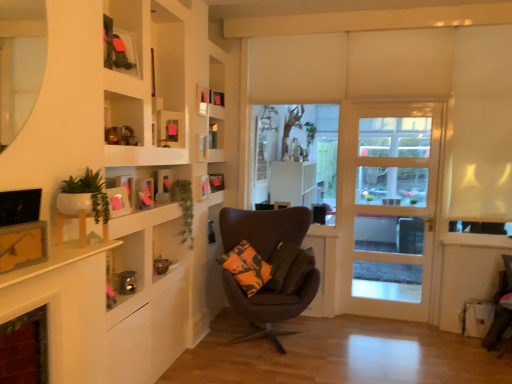
At what (x,y) coordinates should I click in order to perform the action: click on matte pink picture frame at upper center, positioned as the 3th picture frame in back-to-front order. Please return your answer as a coordinate pair (x, y). Looking at the image, I should click on (203, 187).

Describe the element at coordinates (289, 268) in the screenshot. I see `orange patterned pillow at center` at that location.

Describe the element at coordinates (146, 84) in the screenshot. The height and width of the screenshot is (384, 512). I see `wooden shelves at upper left` at that location.

The image size is (512, 384). What are the coordinates of `pink matte picture frame at upper center, acting as the 8th picture frame starting from the back` in the screenshot? It's located at (145, 193).

You are a GUI agent. You are given a task and a screenshot of the screen. Output one action in this format:
    pyautogui.click(x=<x>, y=<y>)
    Task: Click on the matte white picture frame at upper center, positioned as the seventh picture frame in front-to-back order
    
    Given the screenshot: What is the action you would take?
    pyautogui.click(x=202, y=100)

Is velvet dark brown chair at lower right, arranged as the first chair when viewed from the right, next to wooden picture frame at upper center, the 8th picture frame when ordered from front to back?

No, velvet dark brown chair at lower right, arranged as the first chair when viewed from the right, is not next to wooden picture frame at upper center, the 8th picture frame when ordered from front to back.

Does velvet dark brown chair at lower right, arranged as the first chair when viewed from the right, appear on the right side of wooden picture frame at upper center, the 4th picture frame viewed from the back?

Yes, velvet dark brown chair at lower right, arranged as the first chair when viewed from the right, is to the right of wooden picture frame at upper center, the 4th picture frame viewed from the back.

From the image's perspective, count 2nd chairs downward from the wooden picture frame at upper center, the 8th picture frame when ordered from front to back, and point to it. Please provide its 2D coordinates.

[(500, 307)]

Based on the photo, does velvet dark brown chair at lower right, arranged as the first chair when viewed from the right, come behind wooden picture frame at upper center, the 4th picture frame viewed from the back?

No, velvet dark brown chair at lower right, arranged as the first chair when viewed from the right, is in front of wooden picture frame at upper center, the 4th picture frame viewed from the back.

Between orange patterned pillow at center and wooden shelves at upper left, which one appears on the right side from the viewer's perspective?

Positioned to the right is orange patterned pillow at center.

Is orange patterned pillow at center oriented towards wooden shelves at upper left?

No, orange patterned pillow at center does not turn towards wooden shelves at upper left.

Considering the relative sizes of orange patterned pillow at center and wooden shelves at upper left in the image provided, is orange patterned pillow at center bigger than wooden shelves at upper left?

Actually, orange patterned pillow at center might be smaller than wooden shelves at upper left.

Consider the image. Are orange patterned pillow at center and wooden shelves at upper left located far from each other?

Yes, orange patterned pillow at center is far from wooden shelves at upper left.

Based on the photo, between green leafy plant at upper left, placed as the 2th plant when sorted from front to back, and dark brown fabric chair at center, arranged as the first chair when viewed from the left, which one has smaller width?

Thinner between the two is green leafy plant at upper left, placed as the 2th plant when sorted from front to back.

From the image's perspective, who appears lower, green leafy plant at upper left, placed as the 2th plant when sorted from front to back, or dark brown fabric chair at center, arranged as the first chair when viewed from the left?

dark brown fabric chair at center, arranged as the first chair when viewed from the left, appears lower in the image.

What's the angular difference between green leafy plant at upper left, placed as the 2th plant when sorted from front to back, and dark brown fabric chair at center, arranged as the first chair when viewed from the left,'s facing directions?

73 degrees separate the facing orientations of green leafy plant at upper left, placed as the 2th plant when sorted from front to back, and dark brown fabric chair at center, arranged as the first chair when viewed from the left.

From a real-world perspective, who is located higher, green leafy plant at upper left, marked as the 1th plant in a back-to-front arrangement, or dark brown fabric chair at center, arranged as the first chair when viewed from the left?

green leafy plant at upper left, marked as the 1th plant in a back-to-front arrangement.

Considering the relative sizes of pink matte picture frame at upper center, arranged as the 4th picture frame when viewed from the front, and matte pink picture frame at upper center, which is counted as the fifth picture frame, starting from the front, in the image provided, is pink matte picture frame at upper center, arranged as the 4th picture frame when viewed from the front, bigger than matte pink picture frame at upper center, which is counted as the fifth picture frame, starting from the front,?

Actually, pink matte picture frame at upper center, arranged as the 4th picture frame when viewed from the front, might be smaller than matte pink picture frame at upper center, which is counted as the fifth picture frame, starting from the front.

Measure the distance from pink matte picture frame at upper center, acting as the 8th picture frame starting from the back, to matte pink picture frame at upper center, the 7th picture frame when ordered from back to front.

A distance of 16.26 inches exists between pink matte picture frame at upper center, acting as the 8th picture frame starting from the back, and matte pink picture frame at upper center, the 7th picture frame when ordered from back to front.

Considering the sizes of objects pink matte picture frame at upper center, acting as the 8th picture frame starting from the back, and matte pink picture frame at upper center, the 7th picture frame when ordered from back to front, in the image provided, who is shorter, pink matte picture frame at upper center, acting as the 8th picture frame starting from the back, or matte pink picture frame at upper center, the 7th picture frame when ordered from back to front,?

pink matte picture frame at upper center, acting as the 8th picture frame starting from the back, is shorter.

Where is `the 1st picture frame behind the pink matte picture frame at upper center, acting as the 8th picture frame starting from the back, starting your count from the anchor`? the 1st picture frame behind the pink matte picture frame at upper center, acting as the 8th picture frame starting from the back, starting your count from the anchor is located at coordinates (170, 129).

From a real-world perspective, does metallic silver frame at upper left stand above velvet dark brown chair at lower right, placed as the second chair when sorted from left to right?

Indeed, from a real-world perspective, metallic silver frame at upper left stands above velvet dark brown chair at lower right, placed as the second chair when sorted from left to right.

From the image's perspective, would you say metallic silver frame at upper left is positioned over velvet dark brown chair at lower right, placed as the second chair when sorted from left to right?

Indeed, from the image's perspective, metallic silver frame at upper left is shown above velvet dark brown chair at lower right, placed as the second chair when sorted from left to right.

Between metallic silver frame at upper left and velvet dark brown chair at lower right, arranged as the first chair when viewed from the right, which one has more height?

With more height is velvet dark brown chair at lower right, arranged as the first chair when viewed from the right.

Considering the relative positions of matte yellow picture frame at left, which ranks as the 1th picture frame in front-to-back order, and matte pink picture frame at upper center, the 9th picture frame positioned from the front, in the image provided, is matte yellow picture frame at left, which ranks as the 1th picture frame in front-to-back order, behind matte pink picture frame at upper center, the 9th picture frame positioned from the front,?

No, matte yellow picture frame at left, which ranks as the 1th picture frame in front-to-back order, is closer to the camera.

From the image's perspective, is matte yellow picture frame at left, which appears as the eleventh picture frame when viewed from the back, on top of matte pink picture frame at upper center, the 9th picture frame positioned from the front?

Actually, matte yellow picture frame at left, which appears as the eleventh picture frame when viewed from the back, appears below matte pink picture frame at upper center, the 9th picture frame positioned from the front, in the image.

How distant is matte yellow picture frame at left, which appears as the eleventh picture frame when viewed from the back, from matte pink picture frame at upper center, the 9th picture frame positioned from the front?

matte yellow picture frame at left, which appears as the eleventh picture frame when viewed from the back, is 7.08 feet from matte pink picture frame at upper center, the 9th picture frame positioned from the front.

The width and height of the screenshot is (512, 384). I want to click on the 4th picture frame below when counting from the matte pink picture frame at upper center, the 9th picture frame positioned from the front (from the image's perspective), so click(22, 245).

From the image's perspective, which picture frame is the 3rd one above the dark brown fabric chair at center, arranged as the first chair when viewed from the left? Please provide its 2D coordinates.

[(127, 187)]

From a real-world perspective, between pink matte picture frame at upper left, positioned as the third picture frame in front-to-back order, and dark brown fabric chair at center, the second chair from the right, who is vertically lower?

From a 3D spatial view, dark brown fabric chair at center, the second chair from the right, is below.

Based on the photo, from the image's perspective, is pink matte picture frame at upper left, the ninth picture frame when ordered from back to front, below dark brown fabric chair at center, arranged as the first chair when viewed from the left?

No, from the image's perspective, pink matte picture frame at upper left, the ninth picture frame when ordered from back to front, is not below dark brown fabric chair at center, arranged as the first chair when viewed from the left.

From a real-world perspective, starting from the wooden picture frame at upper center, the 4th picture frame viewed from the back, which chair is the 2nd one below it? Please provide its 2D coordinates.

[(500, 307)]

Identify the location of cabinet above the orange patterned pillow at center (from a real-world perspective). (146, 84).

Looking at the image, which one is located closer to white glass door at center, pink matte picture frame at upper center, arranged as the 4th picture frame when viewed from the front, or pink matte picture frame at upper left, positioned as the third picture frame in front-to-back order?

The object closer to white glass door at center is pink matte picture frame at upper center, arranged as the 4th picture frame when viewed from the front.

Estimate the real-world distances between objects in this image. Which object is closer to white glass door at center, wooden shelves at upper left or wooden picture frame at upper center, the 4th picture frame viewed from the back?

Based on the image, wooden picture frame at upper center, the 4th picture frame viewed from the back, appears to be nearer to white glass door at center.

When comparing their distances from pink paper picture frame at left, the 2th picture frame from the front, does white matte planter at left, acting as the 2th plant starting from the back, or wooden picture frame at upper center, the 4th picture frame viewed from the back, seem closer?

Based on the image, white matte planter at left, acting as the 2th plant starting from the back, appears to be nearer to pink paper picture frame at left, the 2th picture frame from the front.

Estimate the real-world distances between objects in this image. Which object is further from matte yellow picture frame at left, which ranks as the 1th picture frame in front-to-back order, white matte planter at left, which appears as the 1th plant when viewed from the front, or pink matte picture frame at upper left, positioned as the third picture frame in front-to-back order?

pink matte picture frame at upper left, positioned as the third picture frame in front-to-back order, is positioned further to the anchor matte yellow picture frame at left, which ranks as the 1th picture frame in front-to-back order.

When comparing their distances from matte black picture frame at upper center, which is the tenth picture frame in front-to-back order, does matte white picture frame at upper center, arranged as the fifth picture frame when viewed from the back, or pink matte picture frame at upper left, the ninth picture frame when ordered from back to front, seem further?

Among the two, pink matte picture frame at upper left, the ninth picture frame when ordered from back to front, is located further to matte black picture frame at upper center, which is the tenth picture frame in front-to-back order.

From the image, which object appears to be farther from matte pink picture frame at upper center, positioned as the 3th picture frame in back-to-front order, wooden shelves at upper left or pink matte picture frame at upper center, acting as the 8th picture frame starting from the back?

wooden shelves at upper left is positioned further to the anchor matte pink picture frame at upper center, positioned as the 3th picture frame in back-to-front order.

Looking at the image, which one is located closer to pink matte picture frame at upper center, acting as the 8th picture frame starting from the back, matte black picture frame at upper center, acting as the 2th picture frame starting from the back, or orange patterned pillow at center?

Among the two, orange patterned pillow at center is located nearer to pink matte picture frame at upper center, acting as the 8th picture frame starting from the back.

Which object lies nearer to the anchor point white glass door at center, wooden shelves at upper left or matte white picture frame at upper center, positioned as the seventh picture frame in front-to-back order?

Based on the image, matte white picture frame at upper center, positioned as the seventh picture frame in front-to-back order, appears to be nearer to white glass door at center.

What are the coordinates of `plant between pink matte picture frame at upper center, arranged as the 4th picture frame when viewed from the front, and wooden picture frame at upper center, the 4th picture frame viewed from the back, from front to back` in the screenshot? It's located at (184, 207).

Identify the location of cabinet between metallic silver frame at upper left and pink matte picture frame at upper left, the ninth picture frame when ordered from back to front, from top to bottom. (146, 84).

Locate an element on the screen. cabinet between metallic silver frame at upper left and orange patterned pillow at center from top to bottom is located at coordinates (146, 84).

The height and width of the screenshot is (384, 512). What are the coordinates of `cabinet positioned between white matte planter at left, acting as the 2th plant starting from the back, and pink matte picture frame at center-left, the sixth picture frame positioned from the front, from near to far` in the screenshot? It's located at (146, 84).